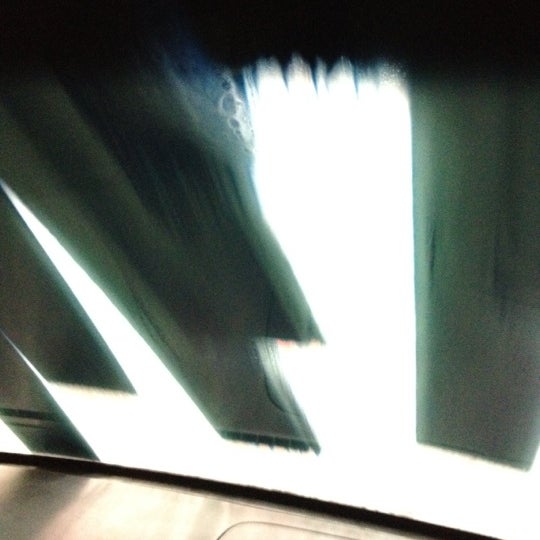
Where is `floor`? floor is located at coordinates point(26,505).